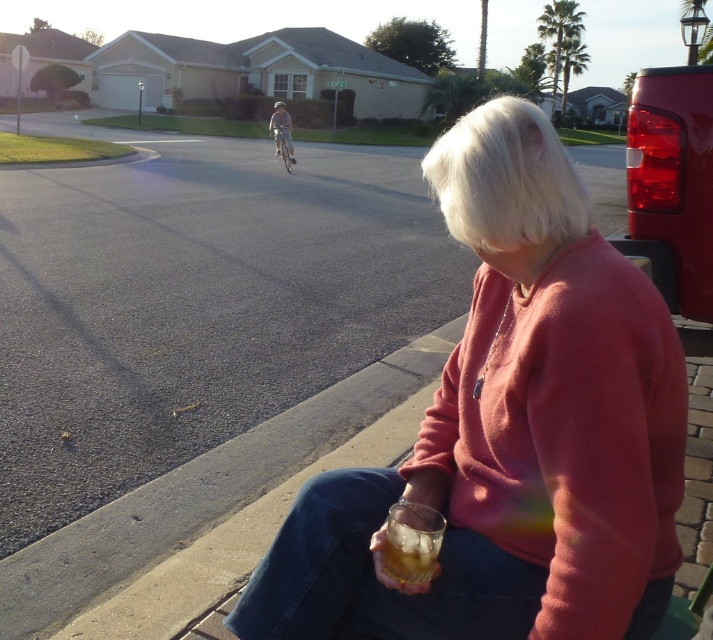
Question: Is pink matte sweater at lower right thinner than translucent glass at lower center?

Choices:
 (A) yes
 (B) no

Answer: (B)

Question: Which point is closer to the camera taking this photo?

Choices:
 (A) (426, 550)
 (B) (610, 541)

Answer: (B)

Question: Which point is closer to the camera taking this photo?

Choices:
 (A) (404, 547)
 (B) (410, 637)

Answer: (A)

Question: Is the position of pink matte sweater at lower right more distant than that of translucent glass at lower center?

Choices:
 (A) yes
 (B) no

Answer: (B)

Question: Observing the image, what is the correct spatial positioning of pink matte sweater at lower right in reference to translucent glass at lower center?

Choices:
 (A) below
 (B) above

Answer: (B)